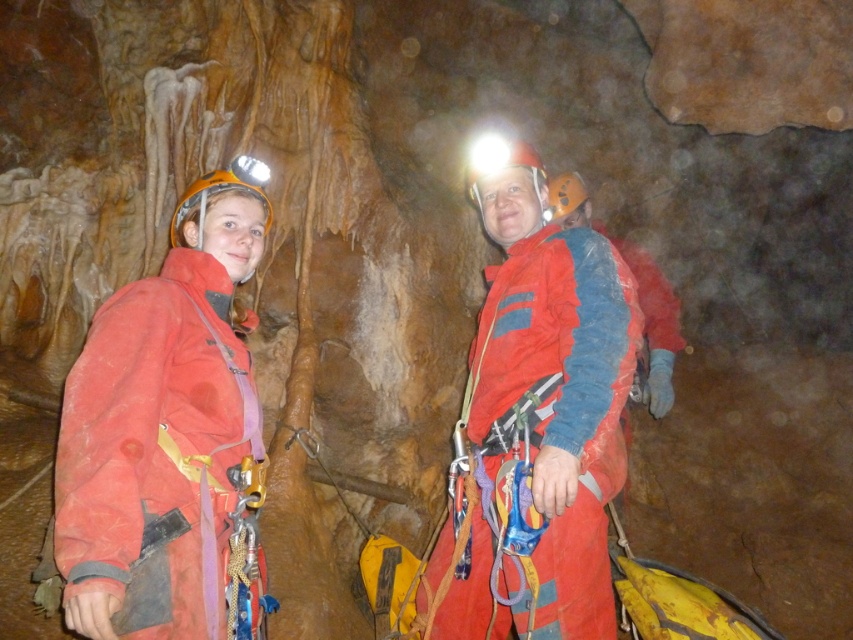
You are a caver planning to move from the entrance of the cave to the back. You see the matte orange helmet at left and the matte red jacket at center. Which object should you head towards first if you want to reach the back of the cave?

The matte orange helmet at left is positioned on the left side of matte red jacket at center, so you should head towards the matte red jacket at center first as it is closer to the back of the cave.

You are a caver trying to locate a specific point in the cave. You see a point at coordinates [165,429]. Which object is this point located on?

The point at coordinates [165,429] is located on the matte orange helmet at left.

You are a caver planning to place two markers in the cave. You have two points marked as point 1 at coordinates (173, 353) and point 2 at coordinates (544, 444). Which point is closer to you when you are facing the cave wall?

Point 1 at coordinates (173, 353) is closer to the viewer than point 2 at coordinates (544, 444).